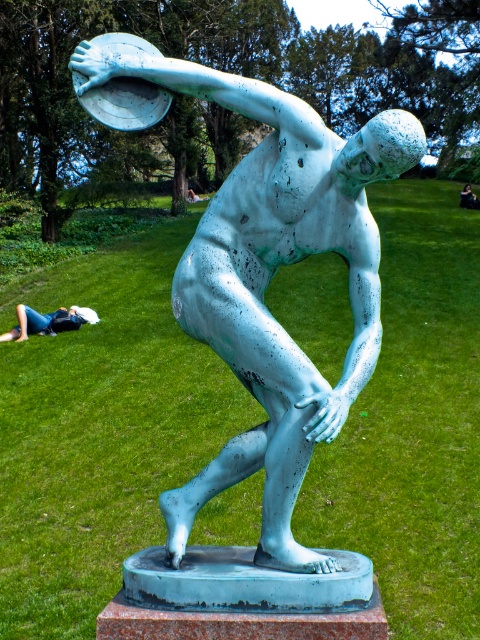
You are a photographer standing at the base of the bronze sculpture of a discus thrower. You want to capture a photo that includes both the white fabric at lower left and the black fabric person at lower right. Given that your camera has a maximum zoom range of 10 meters, will you be able to fit both subjects into the frame without moving closer or farther away?

The white fabric at lower left and black fabric person at lower right are 15.51 meters apart, which exceeds the camera maximum zoom range of 10 meters. Therefore, you cannot fit both subjects into the frame without moving closer or farther away.

You are a visitor at an outdoor art exhibit and see the green patina statue at center and the black fabric person at lower right. Which object is closer to the ground?

The black fabric person at lower right is closer to the ground because the green patina statue at center is positioned under it.